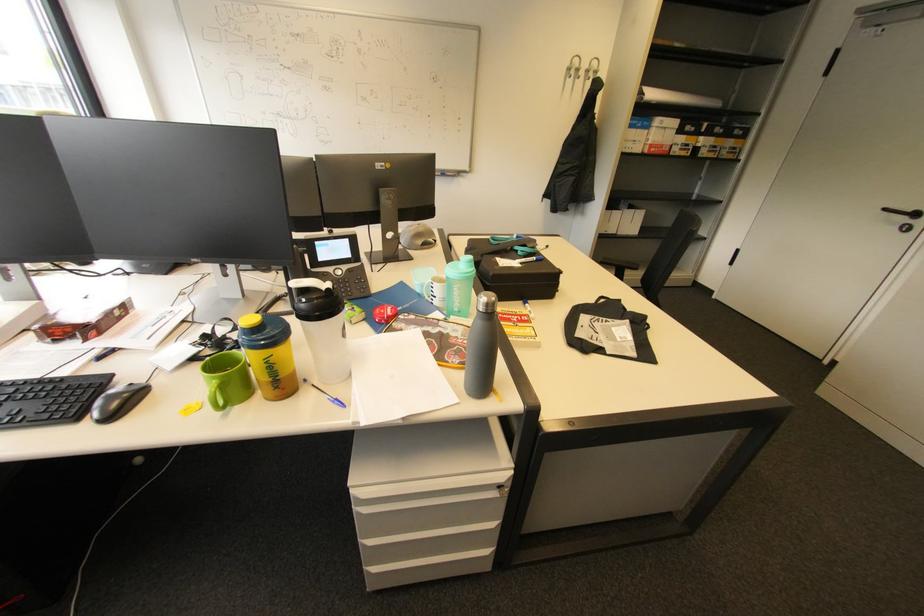
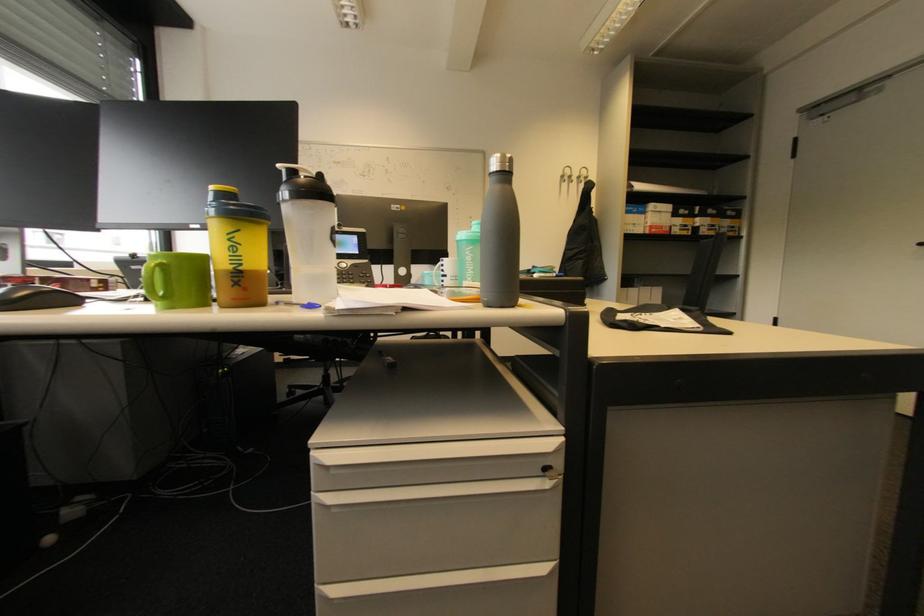
Question: Which direction would the cameraman need to move to produce the second image? Reply with the corresponding letter.

Choices:
 (A) Left
 (B) Right
 (C) Forward
 (D) Backward

Answer: (C)